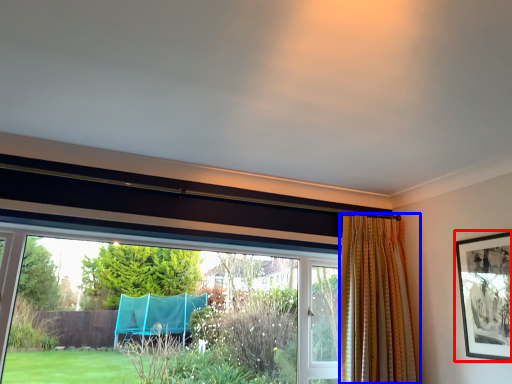
Question: Which object is closer to the camera taking this photo, picture frame (highlighted by a red box) or curtain (highlighted by a blue box)?

Choices:
 (A) picture frame
 (B) curtain

Answer: (A)